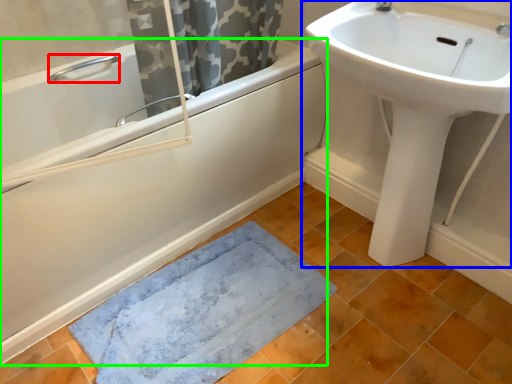
Question: Based on their relative distances, which object is farther from plumbing fixture (highlighted by a red box)? Choose from sink (highlighted by a blue box) and bathtub (highlighted by a green box).

Choices:
 (A) sink
 (B) bathtub

Answer: (A)